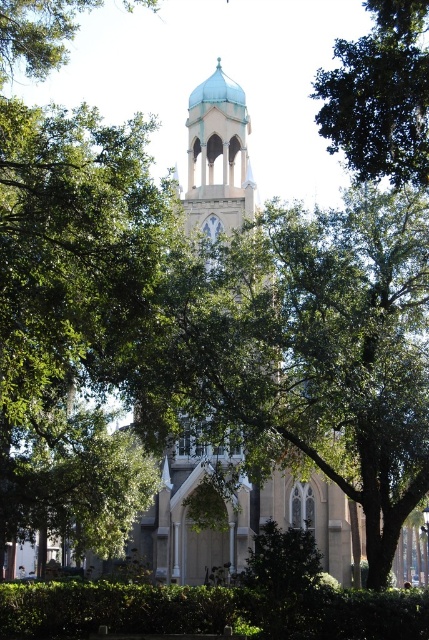
You are standing in front of the church and notice two green leafy trees in the upper corners of the image. Which tree is positioned closer to you, the green leafy tree at upper right or the green leafy tree at upper left?

The green leafy tree at upper right is closer to the viewer than the green leafy tree at upper left.